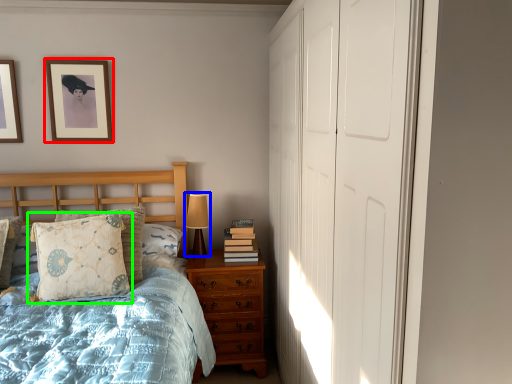
Question: Estimate the real-world distances between objects in this image. Which object is closer to picture frame (highlighted by a red box), table lamp (highlighted by a blue box) or pillow (highlighted by a green box)?

Choices:
 (A) table lamp
 (B) pillow

Answer: (B)